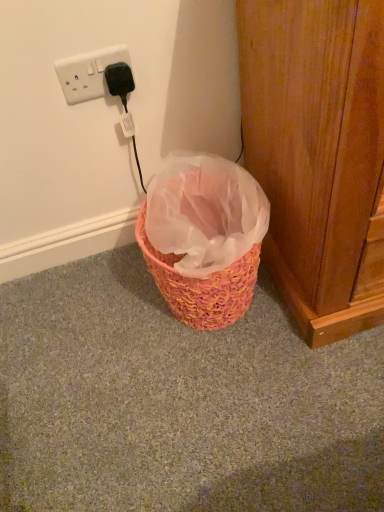
The image size is (384, 512). What do you see at coordinates (318, 154) in the screenshot?
I see `wooden at right` at bounding box center [318, 154].

Find the location of `wooden at right`. wooden at right is located at coordinates (318, 154).

Identify the location of white plastic socket at upper left. This screenshot has width=384, height=512. (88, 73).

Measure the distance between white plastic socket at upper left and camera.

white plastic socket at upper left and camera are 31.96 inches apart from each other.

Describe the element at coordinates (88, 73) in the screenshot. I see `white plastic socket at upper left` at that location.

Identify the location of wooden at right. Image resolution: width=384 pixels, height=512 pixels. (318, 154).

Is wooden at right to the left or to the right of white plastic socket at upper left in the image?

wooden at right is positioned on white plastic socket at upper left's right side.

Considering their positions, is wooden at right located in front of or behind white plastic socket at upper left?

Visually, wooden at right is located in front of white plastic socket at upper left.

Does point (352, 332) appear closer or farther from the camera than point (126, 51)?

Point (352, 332).

From the image's perspective, which one is positioned higher, wooden at right or white plastic socket at upper left?

white plastic socket at upper left.

From a real-world perspective, is wooden at right on white plastic socket at upper left?

Incorrect, from a real-world perspective, wooden at right is lower than white plastic socket at upper left.

Considering the sizes of wooden at right and white plastic socket at upper left in the image, is wooden at right wider or thinner than white plastic socket at upper left?

wooden at right is wider than white plastic socket at upper left.

Who is shorter, wooden at right or white plastic socket at upper left?

With less height is white plastic socket at upper left.

Does wooden at right have a larger size compared to white plastic socket at upper left?

Correct, wooden at right is larger in size than white plastic socket at upper left.

Based on the photo, would you say wooden at right is inside or outside white plastic socket at upper left?

wooden at right lies outside white plastic socket at upper left.

Is wooden at right far from white plastic socket at upper left?

No, wooden at right is not far away from white plastic socket at upper left.

Is wooden at right oriented towards white plastic socket at upper left?

No, wooden at right does not turn towards white plastic socket at upper left.

Where is `door below the white plastic socket at upper left (from the image's perspective)`? This screenshot has width=384, height=512. door below the white plastic socket at upper left (from the image's perspective) is located at coordinates (318, 154).

Does white plastic socket at upper left appear on the left side of wooden at right?

Correct, you'll find white plastic socket at upper left to the left of wooden at right.

Is white plastic socket at upper left closer to the viewer compared to wooden at right?

No, white plastic socket at upper left is further to the viewer.

Is point (69, 65) more distant than point (250, 154)?

That is False.

From the image's perspective, which is above, white plastic socket at upper left or wooden at right?

From the image's view, white plastic socket at upper left is above.

From a real-world perspective, which is physically above, white plastic socket at upper left or wooden at right?

white plastic socket at upper left, from a real-world perspective.

Can you confirm if white plastic socket at upper left is wider than wooden at right?

Incorrect, the width of white plastic socket at upper left does not surpass that of wooden at right.

Can you confirm if white plastic socket at upper left is taller than wooden at right?

Incorrect, the height of white plastic socket at upper left is not larger of that of wooden at right.

Can you confirm if white plastic socket at upper left is bigger than wooden at right?

Incorrect, white plastic socket at upper left is not larger than wooden at right.

Is wooden at right located within white plastic socket at upper left?

No, wooden at right is not inside white plastic socket at upper left.

In the scene shown: Is white plastic socket at upper left far from wooden at right?

No, white plastic socket at upper left is in close proximity to wooden at right.

Is white plastic socket at upper left facing towards wooden at right?

No, white plastic socket at upper left is not oriented towards wooden at right.

The width and height of the screenshot is (384, 512). Identify the location of power plugs and sockets that appears above the wooden at right (from the image's perspective). (88, 73).

Identify the location of power plugs and sockets that appears above the wooden at right (from the image's perspective). (88, 73).

This screenshot has height=512, width=384. In the image, there is a white plastic socket at upper left. What are the coordinates of `door below it (from the image's perspective)` in the screenshot? It's located at (318, 154).